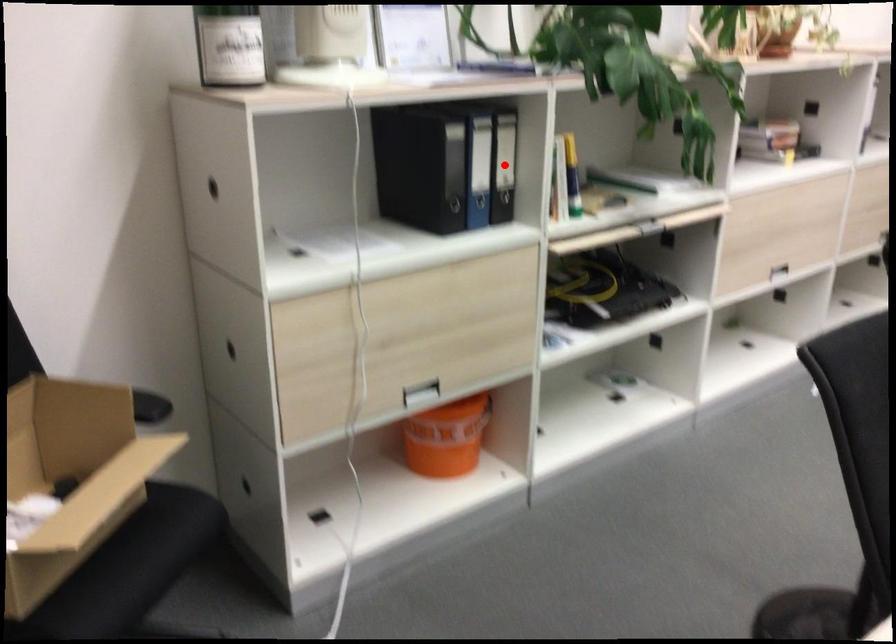
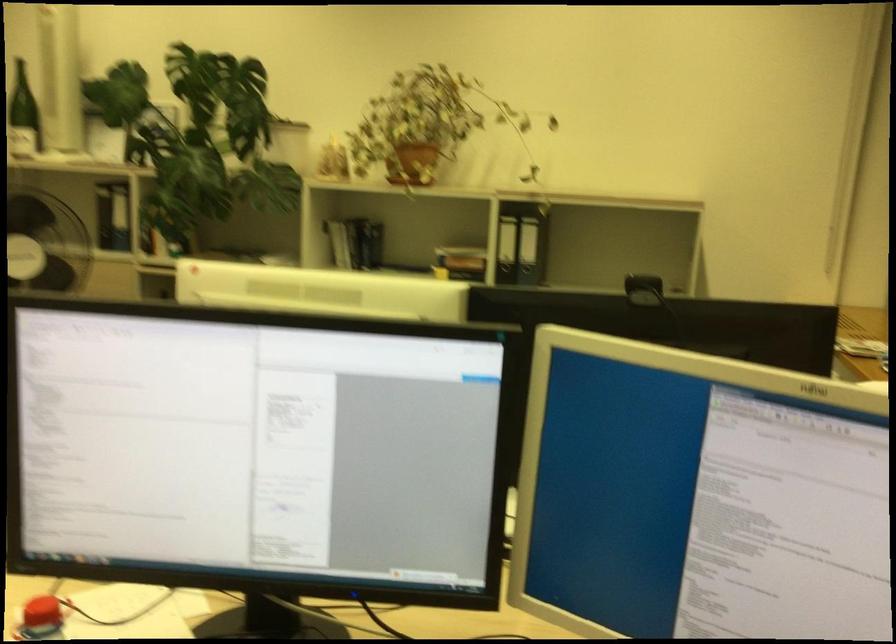
Question: I am providing you with two images of the same scene from different viewpoints. A red point is marked on the first image. Can you still see the location of the red point in image 2?

Choices:
 (A) Yes
 (B) No

Answer: (B)